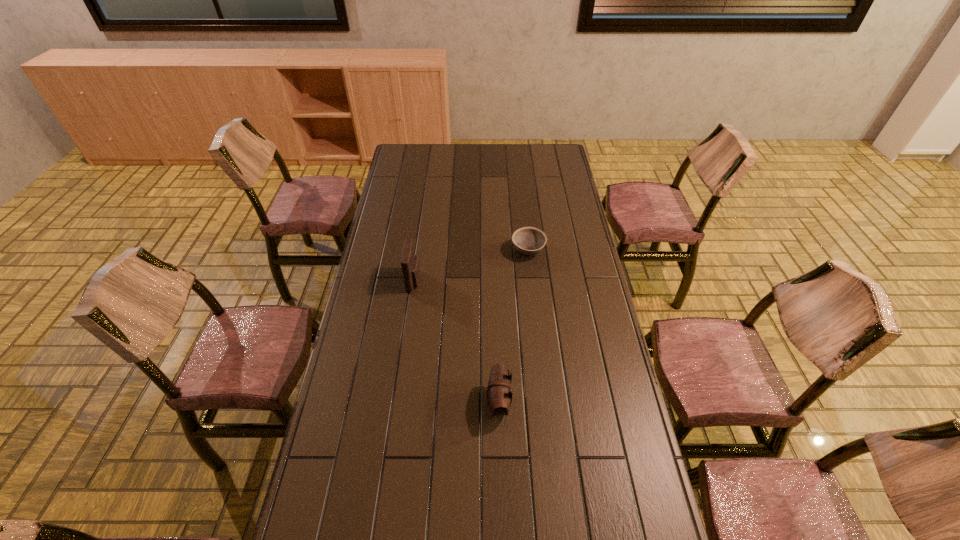
At what (x,y) coordinates should I click in order to perform the action: click on free space located 0.320m on the left of the rightmost object. Please return your answer as a coordinate pair (x, y). The width and height of the screenshot is (960, 540). Looking at the image, I should click on (433, 251).

In the image, there is a desktop. Where is `free space at the far edge`? free space at the far edge is located at coordinates (487, 157).

I want to click on vacant space at the left edge, so click(347, 372).

This screenshot has height=540, width=960. In the image, there is a desktop. In order to click on vacant space at the right edge in this screenshot , I will do `click(593, 297)`.

This screenshot has width=960, height=540. Identify the location of vacant space at the far right corner. (564, 160).

In order to click on free area in between the left pouch and the rightmost object in this screenshot , I will do `click(471, 266)`.

Image resolution: width=960 pixels, height=540 pixels. I want to click on unoccupied position between the second farthest object and the rightmost object, so click(x=471, y=266).

This screenshot has width=960, height=540. What are the coordinates of `empty space between the shorter pouch and the farthest object` in the screenshot? It's located at (514, 327).

At what (x,y) coordinates should I click in order to perform the action: click on empty location between the nearer pouch and the rightmost object. Please return your answer as a coordinate pair (x, y). The image size is (960, 540). Looking at the image, I should click on 514,327.

Where is `empty space between the rightmost object and the second object from right to left`? The height and width of the screenshot is (540, 960). empty space between the rightmost object and the second object from right to left is located at coordinates (514, 327).